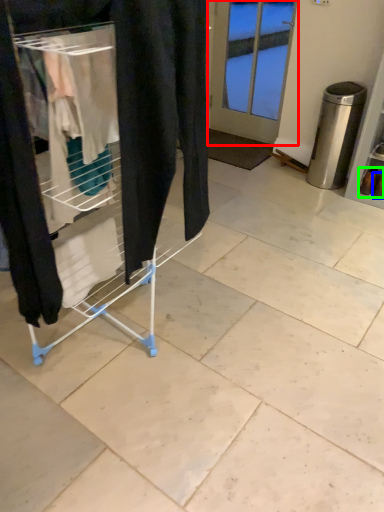
Question: Based on their relative distances, which object is farther from door (highlighted by a red box)? Choose from footwear (highlighted by a blue box) and footwear (highlighted by a green box).

Choices:
 (A) footwear
 (B) footwear

Answer: (A)